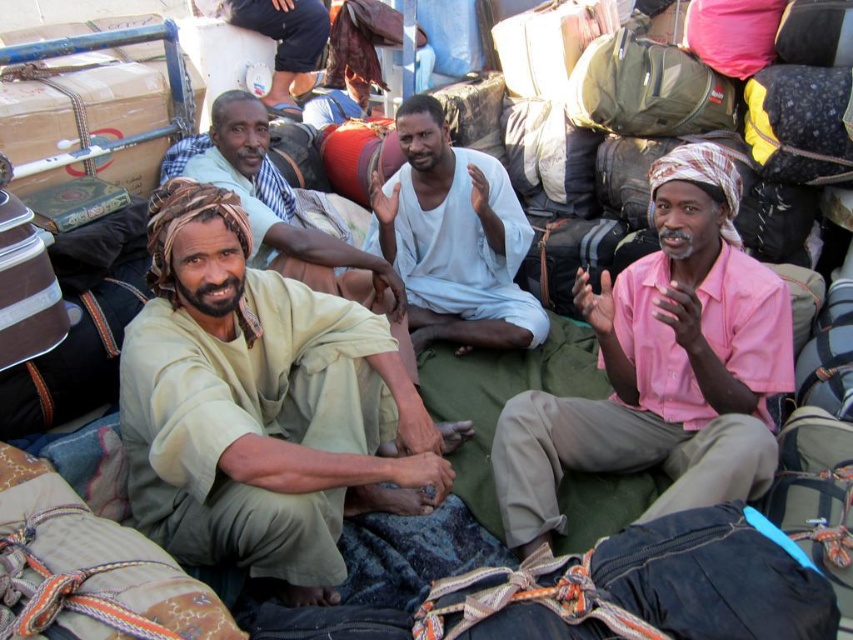
Question: Which of the following is the farthest from the observer?

Choices:
 (A) light beige fabric at center
 (B) white cotton shirt at center
 (C) beige fabric at center
 (D) pink cotton shirt at center

Answer: (B)

Question: Is beige fabric at center further to the viewer compared to pink cotton shirt at center?

Choices:
 (A) no
 (B) yes

Answer: (A)

Question: Does beige fabric at center come in front of light beige fabric at center?

Choices:
 (A) no
 (B) yes

Answer: (B)

Question: Which of these objects is positioned closest to the white cotton shirt at center?

Choices:
 (A) light beige fabric at center
 (B) pink cotton shirt at center

Answer: (A)

Question: Estimate the real-world distances between objects in this image. Which object is closer to the white cotton shirt at center?

Choices:
 (A) beige fabric at center
 (B) pink cotton shirt at center
 (C) light beige fabric at center

Answer: (C)

Question: From the image, what is the correct spatial relationship of pink cotton shirt at center in relation to light beige fabric at center?

Choices:
 (A) above
 (B) below

Answer: (B)